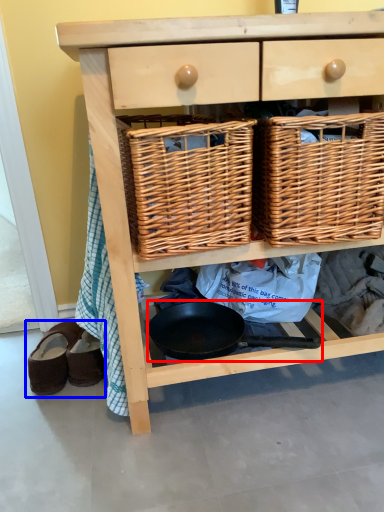
Question: Which point is closer to the camera, frying pan (highlighted by a red box) or footwear (highlighted by a blue box)?

Choices:
 (A) frying pan
 (B) footwear

Answer: (A)